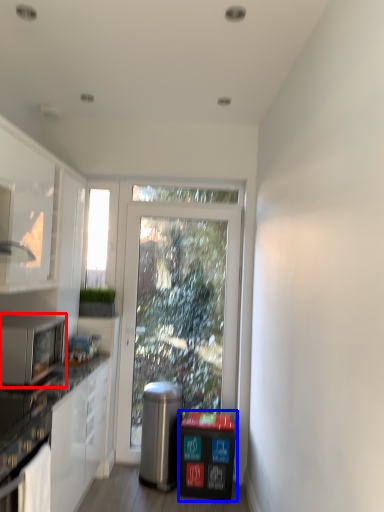
Question: Which object is closer to the camera taking this photo, microwave oven (highlighted by a red box) or recycling bin (highlighted by a blue box)?

Choices:
 (A) microwave oven
 (B) recycling bin

Answer: (A)